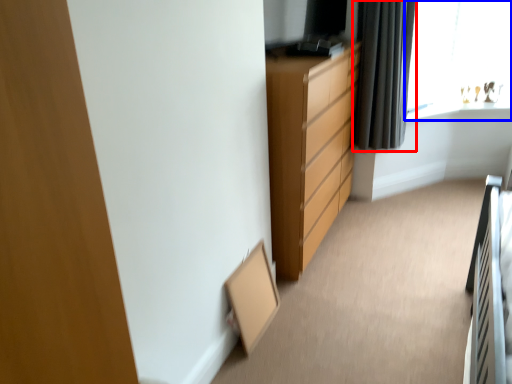
Question: Which object appears farthest to the camera in this image, curtain (highlighted by a red box) or window (highlighted by a blue box)?

Choices:
 (A) curtain
 (B) window

Answer: (B)